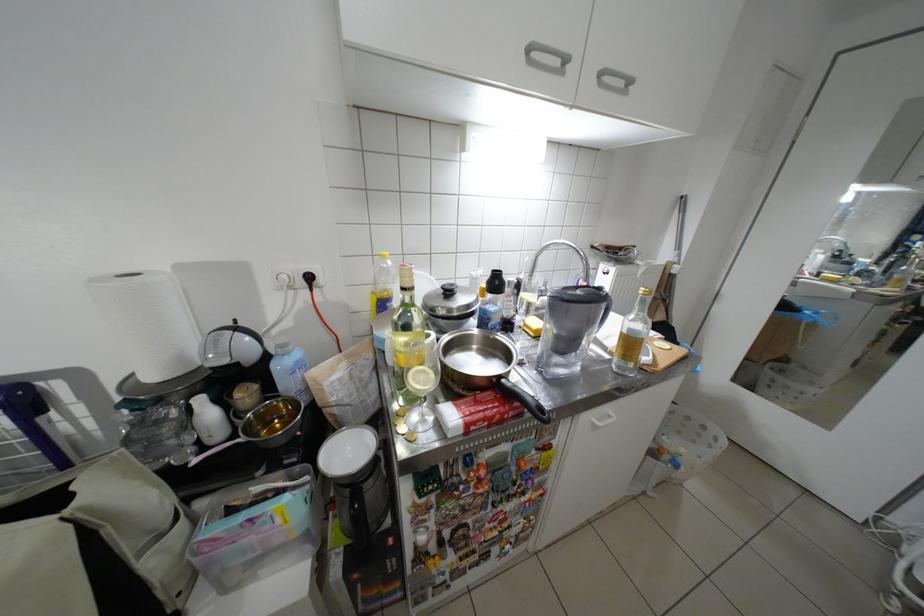
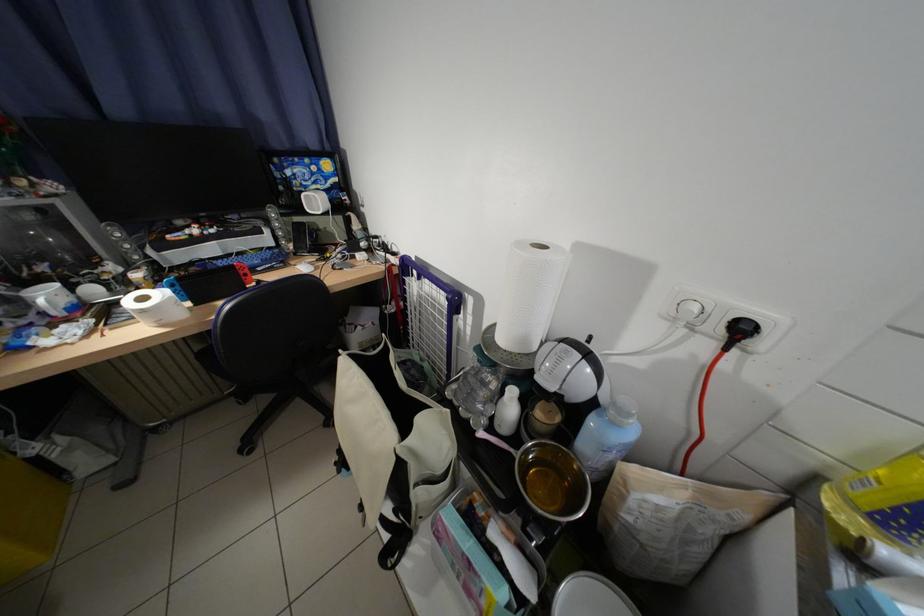
Where in the second image is the point corresponding to point (332, 282) from the first image?

(772, 345)